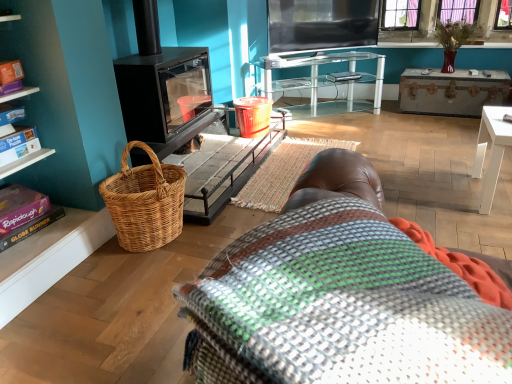
Question: Which is correct: brown leather bean bag chair at lower center is inside woven wicker basket at left, or outside of it?

Choices:
 (A) inside
 (B) outside

Answer: (B)

Question: From a real-world perspective, relative to woven wicker basket at left, is brown leather bean bag chair at lower center vertically above or below?

Choices:
 (A) above
 (B) below

Answer: (A)

Question: Estimate the real-world distances between objects in this image. Which object is closer to the brown leather bean bag chair at lower center?

Choices:
 (A) multicolored woven blanket at center
 (B) flat-screen tv at upper center
 (C) clear glass table at upper center, placed as the 2th table when sorted from bottom to top
 (D) woven wicker basket at left
 (E) black matte fireplace at left

Answer: (D)

Question: Which of these objects is positioned farthest from the woven wicker basket at left?

Choices:
 (A) white glossy table at lower right, the second table from the left
 (B) black matte fireplace at left
 (C) multicolored woven blanket at center
 (D) brown leather bean bag chair at lower center
 (E) purple matte book at lower left

Answer: (A)